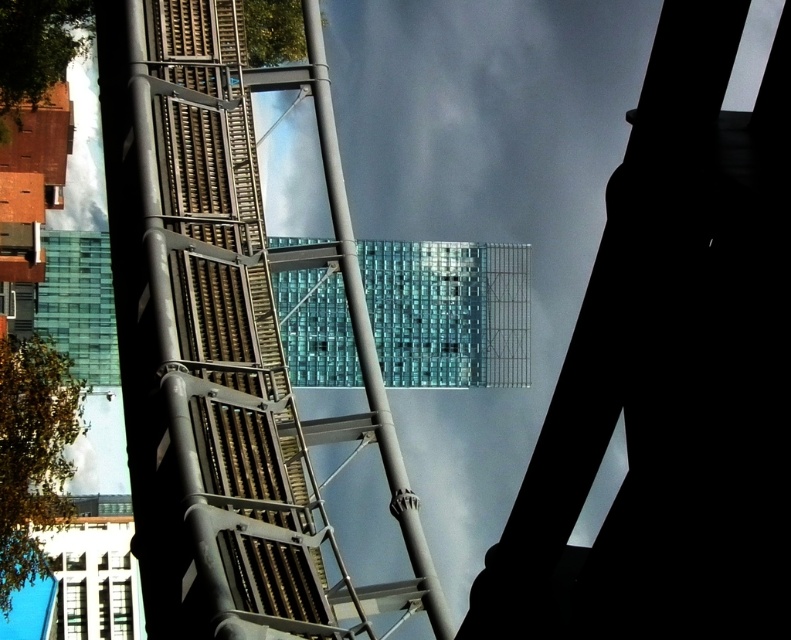
From the picture: You are standing in the urban scene and want to determine which of the two points, point (384, 412) or point (445, 605), is closer to you. Based on the scene, which point is nearer?

Point (384, 412) is closer to you because it is further to the viewer than point (445, 605).

You are a window cleaner standing on the ground and looking up at the translucent glass tower at center and the metallic gray pole at center. Which object is closer to the ground?

The metallic gray pole at center is closer to the ground because the translucent glass tower at center is positioned under it.

You are a photographer aiming to capture the translucent glass tower at center and the metallic gray pole at center in a single shot. Based on their positions, which object will appear closer to the camera in the final photo?

The translucent glass tower at center is in front of the metallic gray pole at center, so it will appear closer to the camera in the final photo.